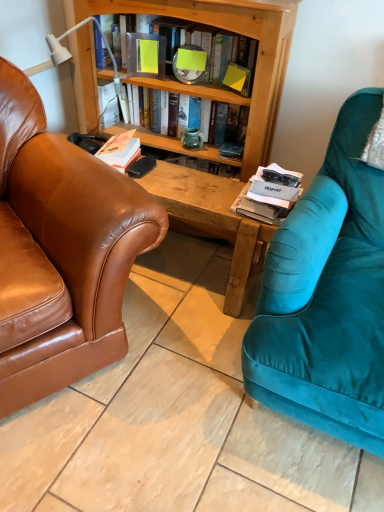
Describe the element at coordinates (120, 150) in the screenshot. I see `white matte book at center, acting as the first book starting from the bottom` at that location.

Identify the location of teal glass vase at center. (192, 138).

What is the approximate width of brown leather couch at left?

3.49 feet.

Find the location of a particular element. The image size is (384, 512). white matte book at center, the third book when ordered from top to bottom is located at coordinates (120, 150).

Is white paper magazine at center turned away from teal glass vase at center?

white paper magazine at center does not have its back to teal glass vase at center.

Considering the sizes of objects white paper magazine at center and teal glass vase at center in the image provided, who is bigger, white paper magazine at center or teal glass vase at center?

Bigger between the two is white paper magazine at center.

Identify the location of magazine on the right side of teal glass vase at center. The width and height of the screenshot is (384, 512). (270, 194).

Considering the sizes of white paper magazine at center and teal glass vase at center in the image, is white paper magazine at center wider or thinner than teal glass vase at center?

Clearly, white paper magazine at center has more width compared to teal glass vase at center.

Between brown leather couch at left and teal glass vase at center, which one is positioned in front?

Positioned in front is brown leather couch at left.

Is brown leather couch at left next to teal glass vase at center and touching it?

No, brown leather couch at left is not with teal glass vase at center.

Which object is thinner, brown leather couch at left or teal glass vase at center?

Thinner between the two is teal glass vase at center.

From a real-world perspective, which object rests below the other?

From a 3D spatial view, teal glass vase at center is below.

I want to click on book below the teal glass vase at center (from a real-world perspective), so click(x=120, y=150).

Is white matte book at center, acting as the first book starting from the bottom, to the left of teal glass vase at center from the viewer's perspective?

Yes.

Could you measure the distance between white matte book at center, the third book when ordered from top to bottom, and teal glass vase at center?

white matte book at center, the third book when ordered from top to bottom, and teal glass vase at center are 12.91 inches apart from each other.

Looking at this image, could you tell me if white matte book at center, acting as the first book starting from the bottom, is facing teal glass vase at center?

No, white matte book at center, acting as the first book starting from the bottom, is not aimed at teal glass vase at center.

Find the location of `book that appears above the hardcover book at center, which is counted as the second book, starting from the bottom (from a real-world perspective)`. book that appears above the hardcover book at center, which is counted as the second book, starting from the bottom (from a real-world perspective) is located at coordinates (189, 70).

Is matte plastic book at upper center, the first book when ordered from top to bottom, completely or partially outside of hardcover book at center, which is counted as the second book, starting from the bottom?

Yes, matte plastic book at upper center, the first book when ordered from top to bottom, is located beyond the bounds of hardcover book at center, which is counted as the second book, starting from the bottom.

Based on the photo, is matte plastic book at upper center, the third book in the bottom-to-top sequence, positioned with its back to hardcover book at center, which is counted as the second book, starting from the bottom?

That's not correct — matte plastic book at upper center, the third book in the bottom-to-top sequence, is not looking away from hardcover book at center, which is counted as the second book, starting from the bottom.

From the image's perspective, starting from the brown leather couch at left, which book is the 1st one above? Please provide its 2D coordinates.

[(120, 150)]

Relative to brown leather couch at left, is white matte book at center, acting as the first book starting from the bottom, in front or behind?

Visually, white matte book at center, acting as the first book starting from the bottom, is located behind brown leather couch at left.

How far apart are white matte book at center, the third book when ordered from top to bottom, and brown leather couch at left?

white matte book at center, the third book when ordered from top to bottom, is 19.25 inches from brown leather couch at left.

Considering the sizes of white matte book at center, acting as the first book starting from the bottom, and brown leather couch at left in the image, is white matte book at center, acting as the first book starting from the bottom, bigger or smaller than brown leather couch at left?

Considering their sizes, white matte book at center, acting as the first book starting from the bottom, takes up less space than brown leather couch at left.

Is brown leather couch at left thinner than hardcover book at center, which is counted as the second book, starting from the bottom?

Incorrect, the width of brown leather couch at left is not less than that of hardcover book at center, which is counted as the second book, starting from the bottom.

Is brown leather couch at left taller than hardcover book at center, acting as the 2th book starting from the top?

Indeed, brown leather couch at left has a greater height compared to hardcover book at center, acting as the 2th book starting from the top.

Who is bigger, brown leather couch at left or hardcover book at center, which is counted as the second book, starting from the bottom?

brown leather couch at left is bigger.

Is brown leather couch at left turned away from hardcover book at center, which is counted as the second book, starting from the bottom?

brown leather couch at left is not turned away from hardcover book at center, which is counted as the second book, starting from the bottom.

Identify the location of book that appears below the teal glass vase at center (from a real-world perspective). (120, 150).

Is white matte book at center, acting as the first book starting from the bottom, inside teal glass vase at center?

Actually, white matte book at center, acting as the first book starting from the bottom, is outside teal glass vase at center.

From the image's perspective, is teal glass vase at center beneath white matte book at center, acting as the first book starting from the bottom?

No.

Can you confirm if teal glass vase at center is wider than white matte book at center, acting as the first book starting from the bottom?

No.

This screenshot has height=512, width=384. What are the coordinates of `magazine above the teal glass vase at center (from a real-world perspective)` in the screenshot? It's located at pos(270,194).

What are the coordinates of `chair that appears below the teal glass vase at center (from the image's perspective)` in the screenshot? It's located at (60, 251).

Considering their positions, is white paper magazine at center positioned further to teal glass vase at center than hardcover book at center, acting as the 2th book starting from the top?

white paper magazine at center is positioned further to the anchor teal glass vase at center.

Considering their positions, is white paper magazine at center positioned further to brown leather couch at left than teal glass vase at center?

teal glass vase at center lies further to brown leather couch at left than the other object.

Based on their spatial positions, is brown leather couch at left or hardcover book at center, acting as the 2th book starting from the top, closer to teal glass vase at center?

hardcover book at center, acting as the 2th book starting from the top, is positioned closer to the anchor teal glass vase at center.

From the image, which object appears to be farther from brown leather couch at left, white matte book at center, the third book when ordered from top to bottom, or matte plastic book at upper center, the first book when ordered from top to bottom?

matte plastic book at upper center, the first book when ordered from top to bottom.

From the image, which object appears to be farther from brown leather couch at left, matte plastic book at upper center, the third book in the bottom-to-top sequence, or white matte book at center, acting as the first book starting from the bottom?

Based on the image, matte plastic book at upper center, the third book in the bottom-to-top sequence, appears to be further to brown leather couch at left.

When comparing their distances from brown leather couch at left, does teal glass vase at center or white matte book at center, acting as the first book starting from the bottom, seem closer?

white matte book at center, acting as the first book starting from the bottom, is positioned closer to the anchor brown leather couch at left.

Estimate the real-world distances between objects in this image. Which object is further from white paper magazine at center, brown leather couch at left or hardcover book at center, acting as the 2th book starting from the top?

brown leather couch at left.

Estimate the real-world distances between objects in this image. Which object is closer to white paper magazine at center, white matte book at center, acting as the first book starting from the bottom, or matte plastic book at upper center, the first book when ordered from top to bottom?

Among the two, matte plastic book at upper center, the first book when ordered from top to bottom, is located nearer to white paper magazine at center.

Where is `book that lies between matte plastic book at upper center, the first book when ordered from top to bottom, and white matte book at center, the third book when ordered from top to bottom, from top to bottom`? book that lies between matte plastic book at upper center, the first book when ordered from top to bottom, and white matte book at center, the third book when ordered from top to bottom, from top to bottom is located at coordinates (177, 145).

Find the location of a particular element. Image resolution: width=384 pixels, height=512 pixels. book between matte plastic book at upper center, the first book when ordered from top to bottom, and teal glass vase at center, in the vertical direction is located at coordinates point(177,145).

At what (x,y) coordinates should I click in order to perform the action: click on teal between matte plastic book at upper center, the third book in the bottom-to-top sequence, and white paper magazine at center from top to bottom. Please return your answer as a coordinate pair (x, y). Image resolution: width=384 pixels, height=512 pixels. Looking at the image, I should click on (192, 138).

The width and height of the screenshot is (384, 512). I want to click on teal situated between white matte book at center, acting as the first book starting from the bottom, and white paper magazine at center from left to right, so [x=192, y=138].